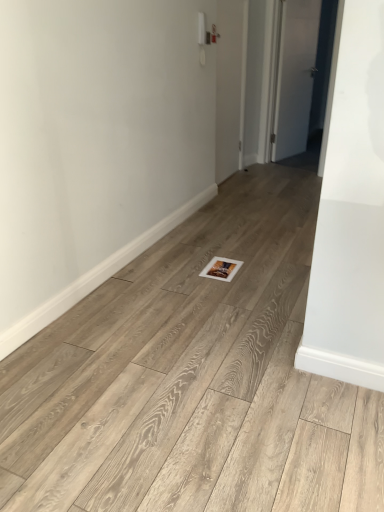
Identify the location of white matte door at center. This screenshot has width=384, height=512. (230, 85).

What do you see at coordinates (230, 85) in the screenshot?
I see `white matte door at center` at bounding box center [230, 85].

The width and height of the screenshot is (384, 512). I want to click on white matte door at center, so click(x=230, y=85).